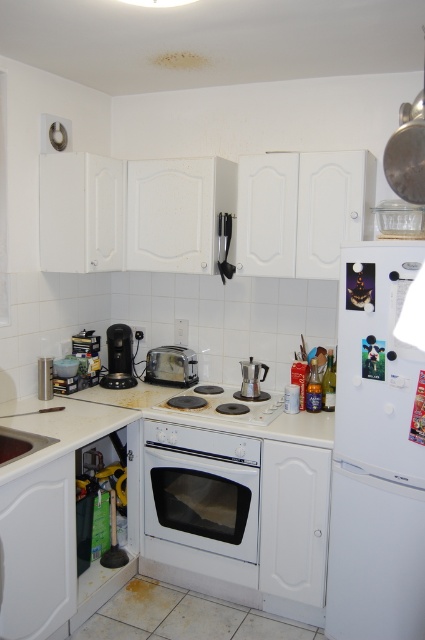
You are a barista setting up for the morning rush. You have a white glossy countertop at lower left and a satin silver coffee maker at center. Where should you place the coffee maker to keep it closest to the water source, which is near the sink on the left side?

The satin silver coffee maker at center should be placed on the white glossy countertop at lower left to be closest to the water source near the sink on the left side, as the white glossy countertop at lower left is already positioned to the left of the satin silver coffee maker at center.

You are organizing the kitchen and want to place a new spice rack on the white glossy countertop at lower left. Since the black plastic coffee machine at lower left is already there, where should you position the spice rack to avoid blocking the coffee machine?

You should place the spice rack to the left of the black plastic coffee machine at lower left since the white glossy countertop at lower left is to the left of it, providing space without blocking the coffee machine.

You are a barista preparing coffee and need to place the satin silver coffee maker at center on the white glossy countertop at center. Will the countertop be able to support the height of the coffee maker?

The white glossy countertop at center is shorter than the satin silver coffee maker at center, so the coffee maker will not fit vertically on the countertop because it is taller than the countertop itself.